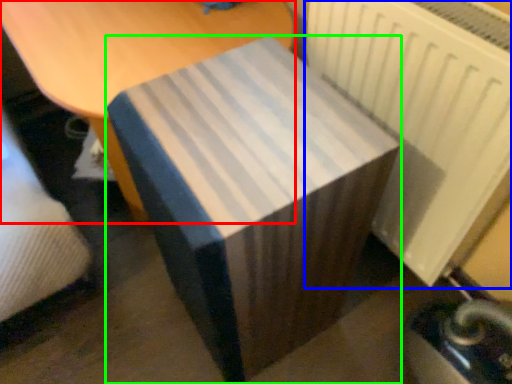
Question: Estimate the real-world distances between objects in this image. Which object is farther from furniture (highlighted by a red box), radiator (highlighted by a blue box) or table (highlighted by a green box)?

Choices:
 (A) radiator
 (B) table

Answer: (A)